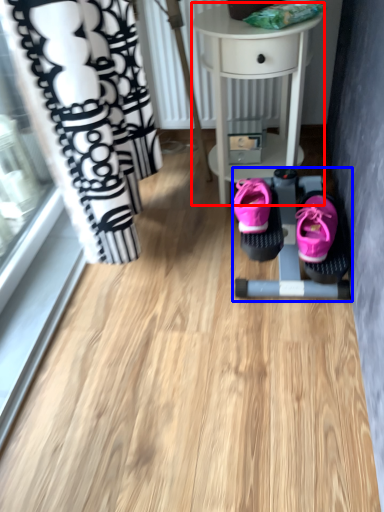
Question: Which object appears farthest to the camera in this image, table (highlighted by a red box) or baby carriage (highlighted by a blue box)?

Choices:
 (A) table
 (B) baby carriage

Answer: (B)